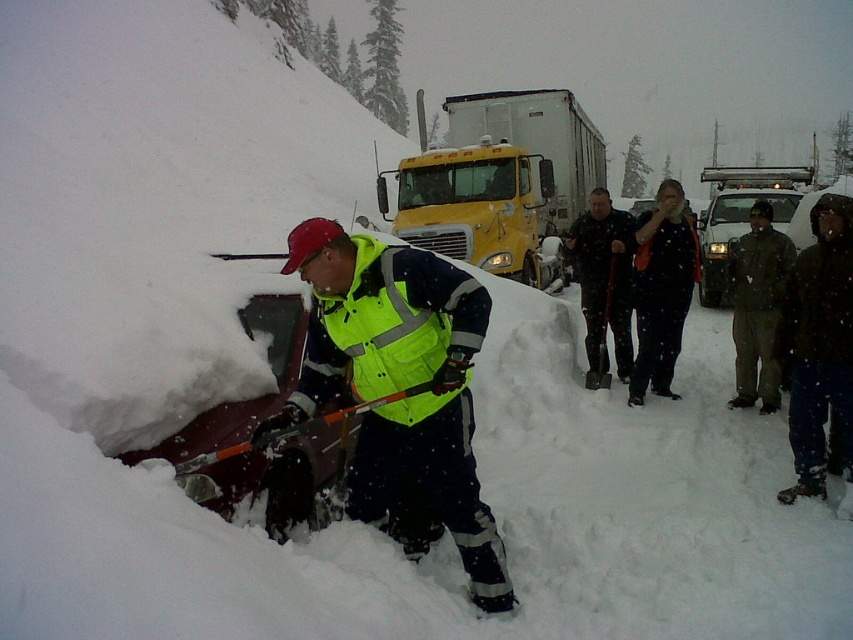
Is neon yellow reflective vest at center further to the viewer compared to dark brown leather jacket at center?

No, neon yellow reflective vest at center is in front of dark brown leather jacket at center.

Who is more forward, (432, 291) or (585, 378)?

Point (432, 291) is more forward.

The height and width of the screenshot is (640, 853). I want to click on neon yellow reflective vest at center, so (399, 381).

Looking at this image, does brown fuzzy jacket at right appear on the left side of dark brown leather jacket at center?

Incorrect, brown fuzzy jacket at right is not on the left side of dark brown leather jacket at center.

From the picture: Can you confirm if brown fuzzy jacket at right is positioned to the right of dark brown leather jacket at center?

Correct, you'll find brown fuzzy jacket at right to the right of dark brown leather jacket at center.

What do you see at coordinates (757, 307) in the screenshot?
I see `brown fuzzy jacket at right` at bounding box center [757, 307].

At what (x,y) coordinates should I click in order to perform the action: click on brown fuzzy jacket at right. Please return your answer as a coordinate pair (x, y). The image size is (853, 640). Looking at the image, I should click on (757, 307).

Between neon yellow reflective safety vest at center and dark brown leather jacket at center, which one has less height?

With less height is neon yellow reflective safety vest at center.

Which is below, neon yellow reflective safety vest at center or dark brown leather jacket at center?

neon yellow reflective safety vest at center is lower down.

The height and width of the screenshot is (640, 853). I want to click on neon yellow reflective safety vest at center, so pyautogui.click(x=386, y=323).